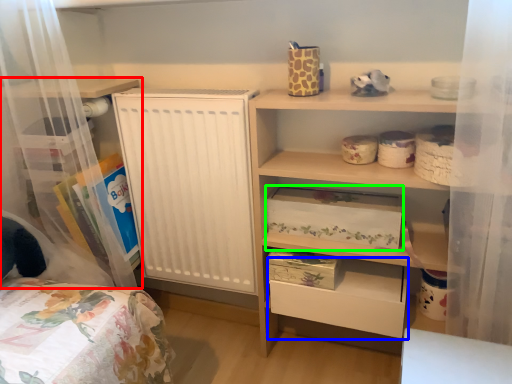
Question: Which is nearer to the shelf (highlighted by a red box)? drawer (highlighted by a blue box) or storage box (highlighted by a green box).

Choices:
 (A) drawer
 (B) storage box

Answer: (B)